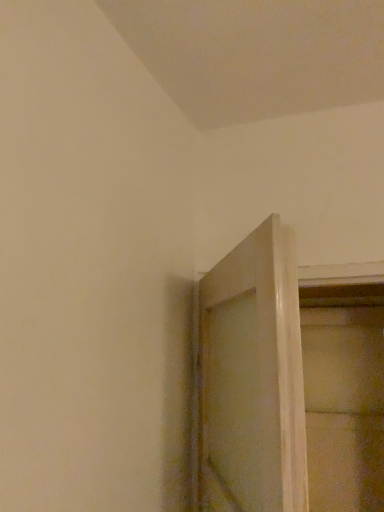
The image size is (384, 512). Describe the element at coordinates (251, 380) in the screenshot. I see `white glossy door at lower right` at that location.

You are a GUI agent. You are given a task and a screenshot of the screen. Output one action in this format:
    pyautogui.click(x=<x>, y=<y>)
    Task: Click on the white glossy door at lower right
    
    Given the screenshot: What is the action you would take?
    pyautogui.click(x=251, y=380)

Where is `white glossy door at lower right`? The width and height of the screenshot is (384, 512). white glossy door at lower right is located at coordinates (251, 380).